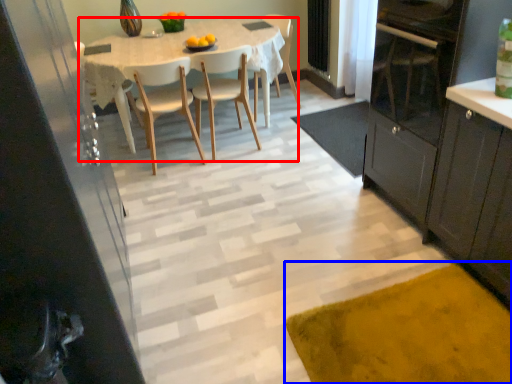
Question: Which object appears closest to the camera in this image, kitchen & dining room table (highlighted by a red box) or doormat (highlighted by a blue box)?

Choices:
 (A) kitchen & dining room table
 (B) doormat

Answer: (B)